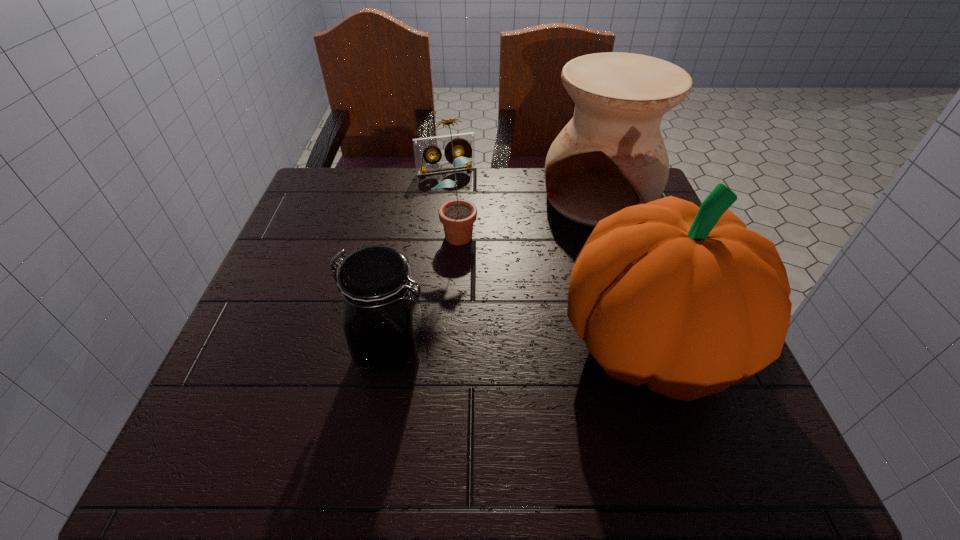
This screenshot has width=960, height=540. I want to click on videotape present at the far edge, so click(x=465, y=142).

The width and height of the screenshot is (960, 540). What are the coordinates of `jar at the near edge` in the screenshot? It's located at (382, 321).

Image resolution: width=960 pixels, height=540 pixels. I want to click on pumpkin that is at the near edge, so click(685, 299).

At what (x,y) coordinates should I click in order to perform the action: click on pumpkin present at the right edge. Please return your answer as a coordinate pair (x, y). This screenshot has height=540, width=960. Looking at the image, I should click on (685, 299).

I want to click on pottery present at the right edge, so click(x=611, y=155).

Locate an element on the screen. The image size is (960, 540). object situated at the far right corner is located at coordinates (611, 155).

At what (x,y) coordinates should I click in order to perform the action: click on object present at the near right corner. Please return your answer as a coordinate pair (x, y). Looking at the image, I should click on (685, 299).

Image resolution: width=960 pixels, height=540 pixels. I want to click on free location at the far edge, so click(394, 187).

In the image, there is a desktop. At what (x,y) coordinates should I click in order to perform the action: click on vacant space at the near edge. Please return your answer as a coordinate pair (x, y). Image resolution: width=960 pixels, height=540 pixels. Looking at the image, I should click on (589, 400).

This screenshot has height=540, width=960. In the image, there is a desktop. In order to click on vacant space at the left edge in this screenshot , I will do `click(267, 307)`.